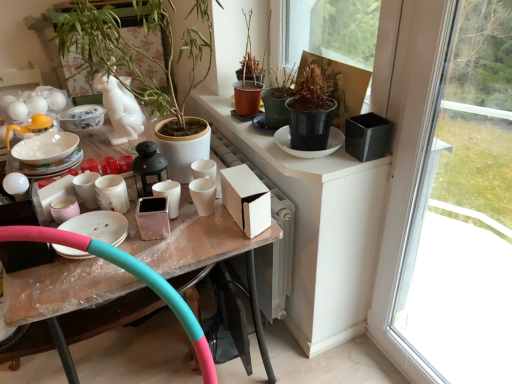
I want to click on vacant space that is to the left of terracotta pot at upper center, which appears as the second houseplant when viewed from the left, so click(x=226, y=114).